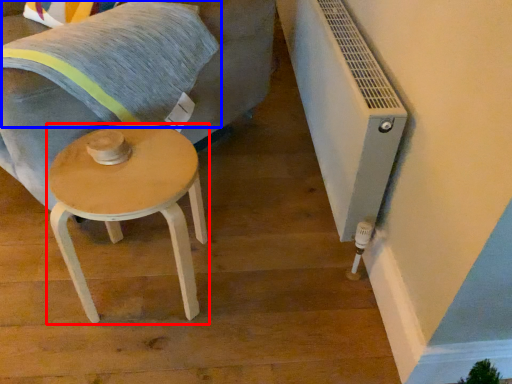
Question: Which object is closer to the camera taking this photo, stool (highlighted by a red box) or pillow (highlighted by a blue box)?

Choices:
 (A) stool
 (B) pillow

Answer: (A)